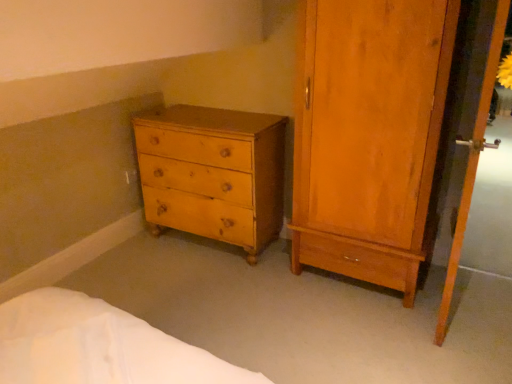
Where is `vacant space underneath wooden screen door at right (from a real-world perspective)`? This screenshot has width=512, height=384. vacant space underneath wooden screen door at right (from a real-world perspective) is located at coordinates click(x=440, y=303).